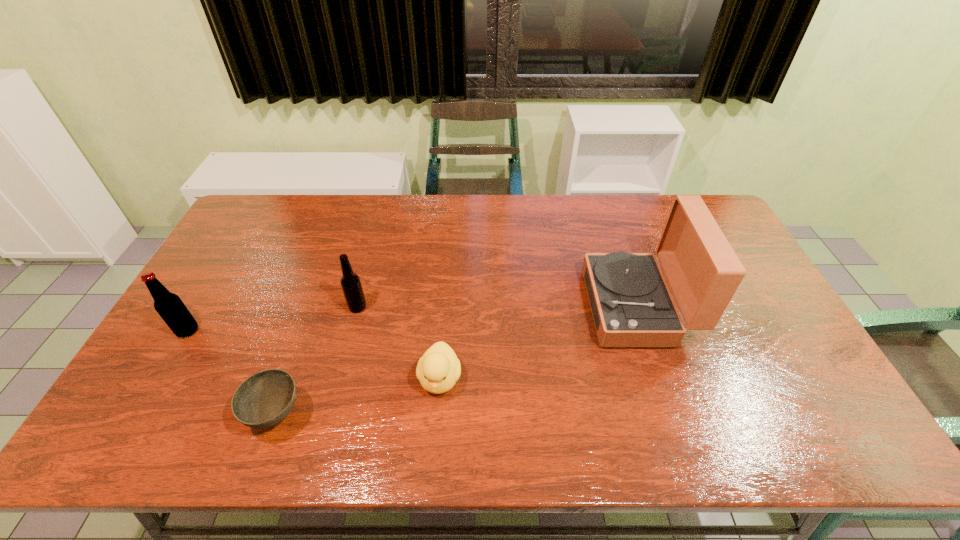
Where is `free space between the right beer bottle and the phonograph record`? free space between the right beer bottle and the phonograph record is located at coordinates (497, 307).

The height and width of the screenshot is (540, 960). Find the location of `free space between the bowl and the leftmost object`. free space between the bowl and the leftmost object is located at coordinates (232, 373).

Find the location of a particular element. Image resolution: width=960 pixels, height=540 pixels. free space between the tallest object and the fourth tallest object is located at coordinates (x=538, y=342).

Identify the location of vacant region between the fourth object from left to right and the rightmost object. click(538, 342).

Locate which object ranks in proximity to the third object from left to right. Please provide its 2D coordinates. Your answer should be formatted as a tuple, i.e. [(x, y)], where the tuple contains the x and y coordinates of a point satisfying the conditions above.

[(438, 369)]

This screenshot has width=960, height=540. In order to click on object that is the second closest one to the right beer bottle in this screenshot , I will do `click(266, 398)`.

I want to click on free space that satisfies the following two spatial constraints: 1. on the face of the phonograph record; 2. on the front side of the farther beer bottle, so click(636, 307).

Image resolution: width=960 pixels, height=540 pixels. I want to click on vacant area that satisfies the following two spatial constraints: 1. on the face of the rightmost object; 2. on the front side of the bowl, so click(672, 415).